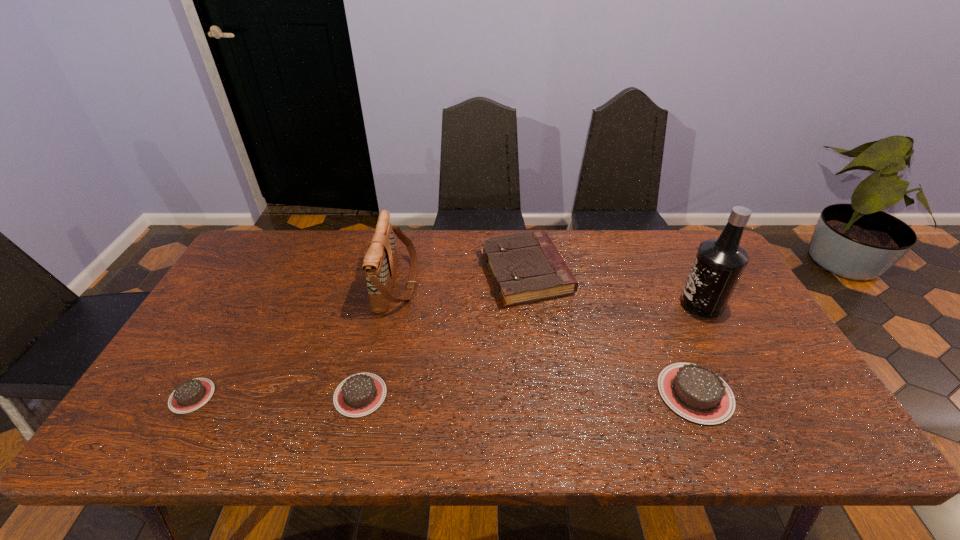
Where is `the leftmost object`? the leftmost object is located at coordinates (192, 394).

The width and height of the screenshot is (960, 540). I want to click on the shortest object, so click(192, 394).

I want to click on the second tallest chocolate cake, so (360, 394).

Find the location of a particular element. The width and height of the screenshot is (960, 540). the second chocolate cake from right to left is located at coordinates (360, 394).

The image size is (960, 540). In order to click on the third shortest object in this screenshot , I will do `click(696, 393)`.

Where is `the tallest chocolate cake`? This screenshot has height=540, width=960. the tallest chocolate cake is located at coordinates (696, 393).

This screenshot has width=960, height=540. I want to click on the fifth shortest object, so click(380, 262).

This screenshot has width=960, height=540. Find the location of `hardback book`. hardback book is located at coordinates (526, 267).

Locate an element on the screen. This screenshot has width=960, height=540. the third tallest object is located at coordinates (526, 267).

The height and width of the screenshot is (540, 960). In order to click on the tallest object in this screenshot , I will do (719, 263).